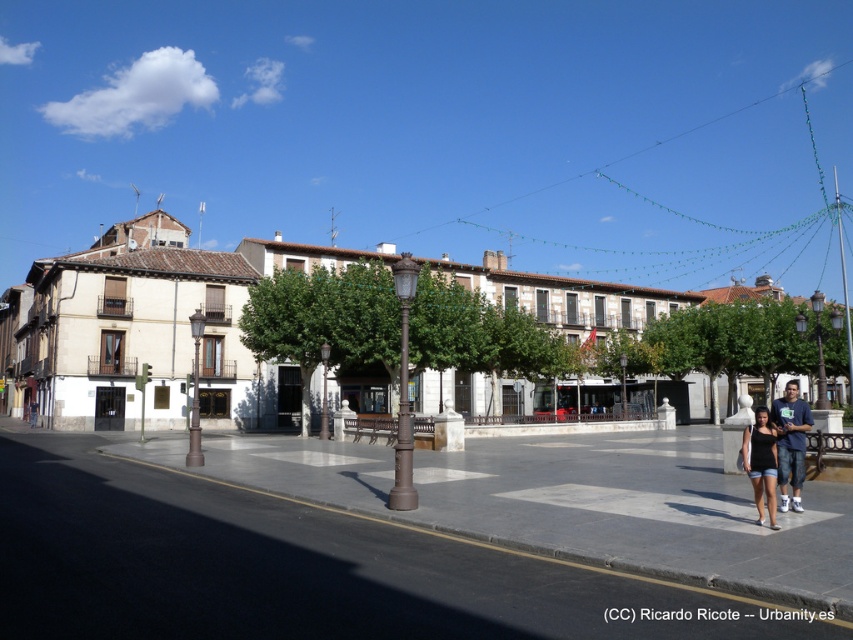
You are an architect visiting the urban square and want to take a photo of the white stone building at center and the matte black shorts at lower right. Since you want both objects to appear in the frame, which one should you focus on to ensure both are captured clearly?

The white stone building at center is larger than the matte black shorts at lower right, so focusing on the white stone building at center will help ensure both are in the frame.

You are standing at the entrance of the square and want to take a photo of the white stone building at center. According to the coordinates provided, in which direction should you move to position yourself correctly for the shot?

The white stone building at center is located at coordinates point (144, 324), so you should move towards the center of the square to position yourself correctly for the shot.